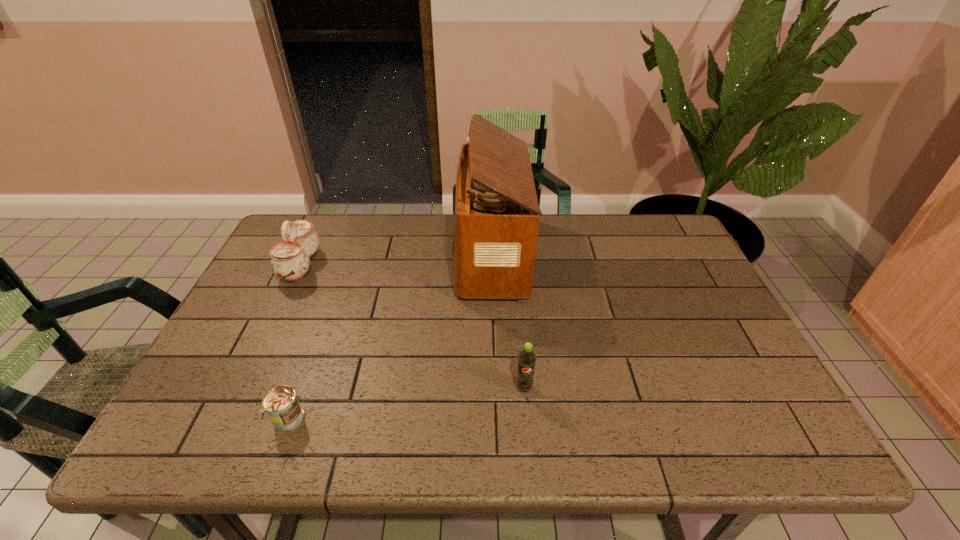
The image size is (960, 540). I want to click on object that is the second closest to the third object from right to left, so click(x=496, y=213).

Locate an element on the screen. free point that satisfies the following two spatial constraints: 1. by the handle of the nearest object; 2. on the right side of the leftmost object is located at coordinates (227, 420).

I want to click on blank area in the image that satisfies the following two spatial constraints: 1. on the front panel of the radio receiver; 2. on the front side of the can, so click(494, 420).

Where is `free spot that satisfies the following two spatial constraints: 1. by the handle of the leftmost object; 2. on the left side of the can`? This screenshot has height=540, width=960. free spot that satisfies the following two spatial constraints: 1. by the handle of the leftmost object; 2. on the left side of the can is located at coordinates (227, 420).

Find the location of a particular element. This screenshot has width=960, height=540. blank area in the image that satisfies the following two spatial constraints: 1. on the front panel of the tallest object; 2. on the front side of the second object from left to right is located at coordinates (494, 420).